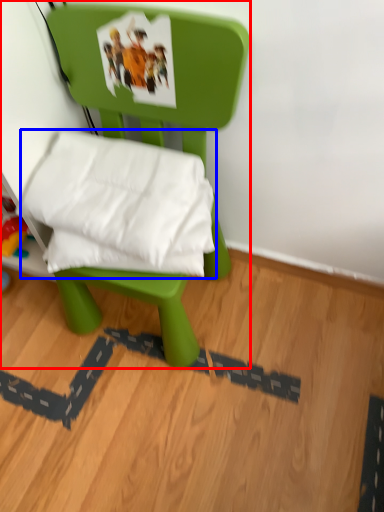
Question: Which object appears farthest to the camera in this image, furniture (highlighted by a red box) or pillow (highlighted by a blue box)?

Choices:
 (A) furniture
 (B) pillow

Answer: (B)